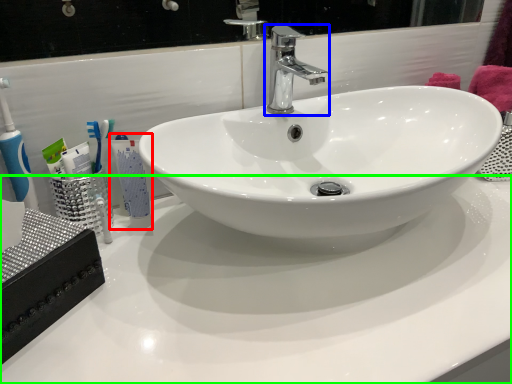
Question: Which object is positioned closest to mouthwash (highlighted by a red box)? Select from tap (highlighted by a blue box) and counter top (highlighted by a green box).

Choices:
 (A) tap
 (B) counter top

Answer: (B)